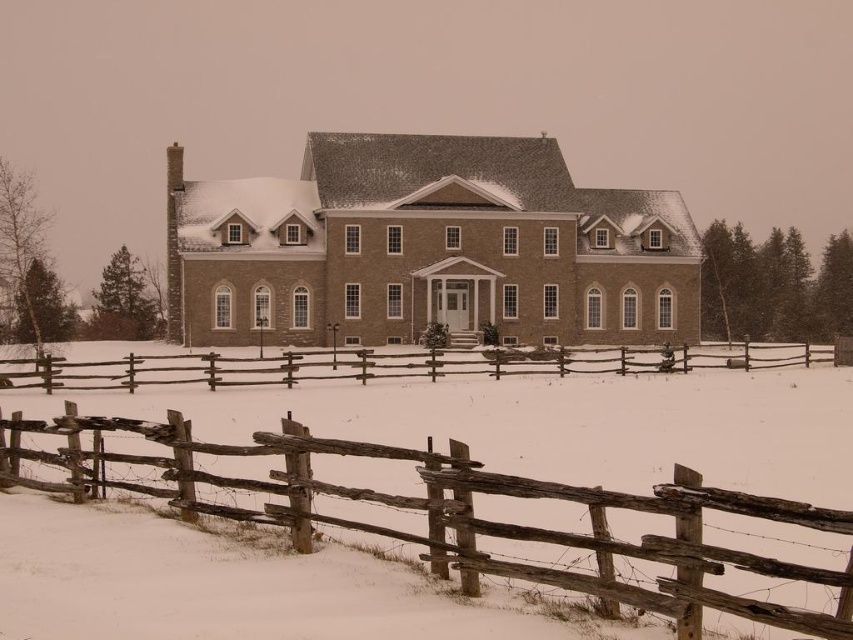
Can you confirm if weathered wood fence at lower center is shorter than weathered wood fence at center?

No, weathered wood fence at lower center is not shorter than weathered wood fence at center.

This screenshot has width=853, height=640. Describe the element at coordinates (465, 515) in the screenshot. I see `weathered wood fence at lower center` at that location.

Which is behind, point (787, 576) or point (109, 371)?

The point (109, 371) is more distant.

Identify the location of weathered wood fence at lower center. (465, 515).